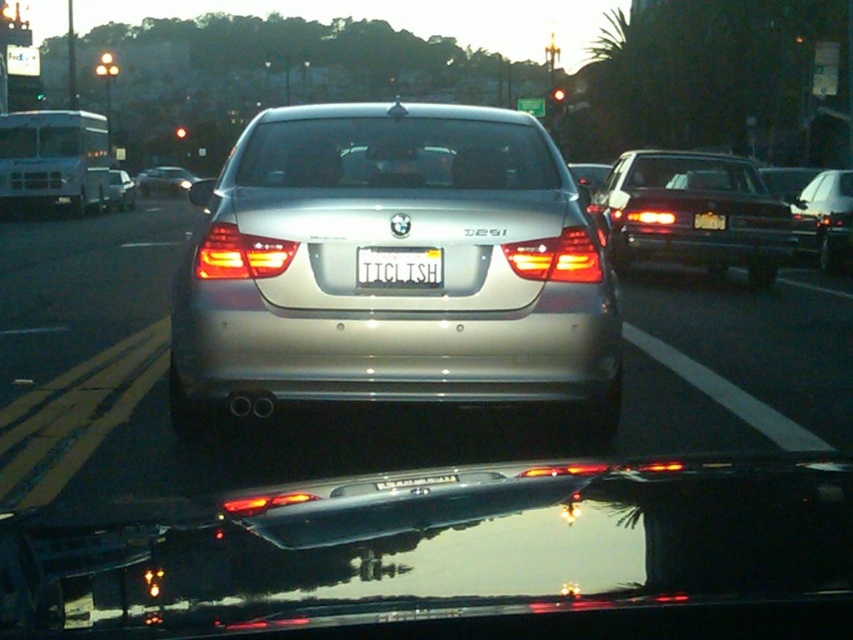
You are a driver who needs to park your car in a parking spot that is exactly 9 meters long. The parking spot has a white line at the entrance. You see the satin metallic sedan at center and the white plastic license plate at center in your rearview mirror. Can you determine if your car will fit in the parking spot?

The satin metallic sedan at center and white plastic license plate at center are 8.89 meters apart, so the parking spot is 9 meters long, which is slightly longer than the distance between the two objects. Therefore, your car should fit comfortably within the parking spot.

You are a passenger in a car and looking at the scene. Where is the satin silver car at center located in terms of coordinates?

The satin silver car at center is located at point coordinates of [457,556].

You are a passenger in the satin silver car at center and want to check the license plate. Can you see the white plastic license plate at center from your current position inside the car?

The satin silver car at center is in front of the white plastic license plate at center, so you cannot see the white plastic license plate at center from inside the satin silver car at center.